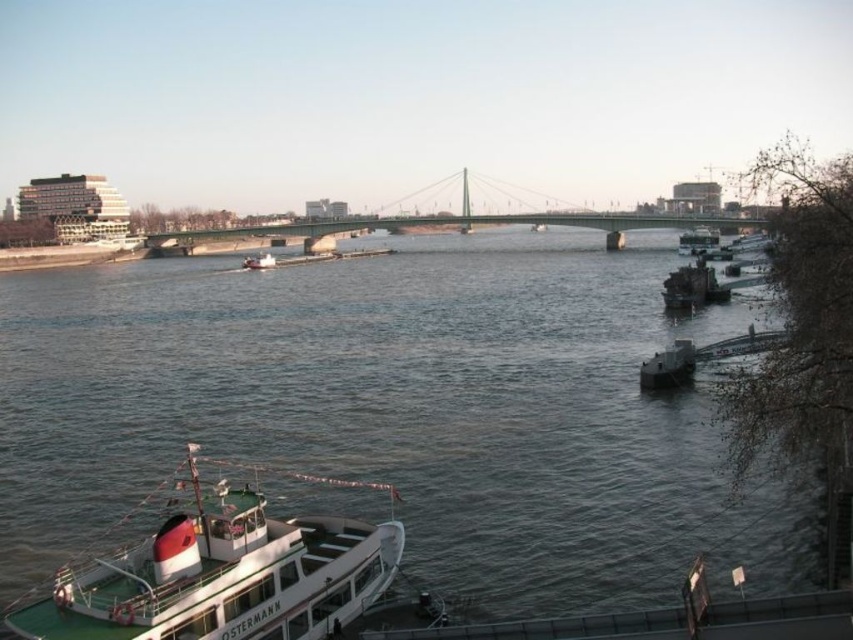
Question: Can you confirm if white matte boat at lower left is positioned to the right of concrete bridge at center?

Choices:
 (A) yes
 (B) no

Answer: (B)

Question: Which of the following is the closest to the observer?

Choices:
 (A) dark gray metallic boat at lower right
 (B) smooth water at center
 (C) white matte boat at lower left

Answer: (C)

Question: Which point is closer to the camera?

Choices:
 (A) dark gray metallic boat at lower right
 (B) white matte boat at lower left
 (C) smooth water at center
 (D) metallic gray barge at center-right

Answer: (B)

Question: Observing the image, what is the correct spatial positioning of metallic gray barge at center-right in reference to dark gray metallic boat at lower right?

Choices:
 (A) left
 (B) right

Answer: (B)

Question: Does concrete bridge at center appear on the left side of dark gray metallic boat at lower right?

Choices:
 (A) no
 (B) yes

Answer: (A)

Question: Which object is positioned closest to the white matte boat at center?

Choices:
 (A) white matte boat at lower left
 (B) dark gray metallic boat at lower right
 (C) concrete bridge at center

Answer: (C)